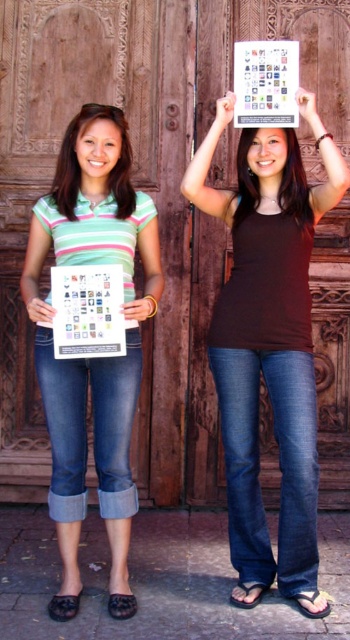
Based on the photo, you are a photographer trying to capture both the brown matte tank top at upper center and the matte green striped shirt at left in a single shot. Based on their positions, can you determine which one is closer to the camera?

The brown matte tank top at upper center is in front of the matte green striped shirt at left, so it is closer to the camera.

You are a photographer trying to capture both the matte green striped shirt at center and the matte brown shirt at upper center in a single frame. Which shirt should you focus on to ensure both are in the frame without cropping?

The matte green striped shirt at center is bigger than the matte brown shirt at upper center, so focusing on the larger one will ensure both shirts are visible in the frame.

You are a visitor at this historical site and want to check the event schedule. Both the white paper calendar at center and the white paper calendar at upper center are available. Which one should you look at to see more details about the events?

The white paper calendar at center has a larger width than the white paper calendar at upper center, so it can display more details about the events.